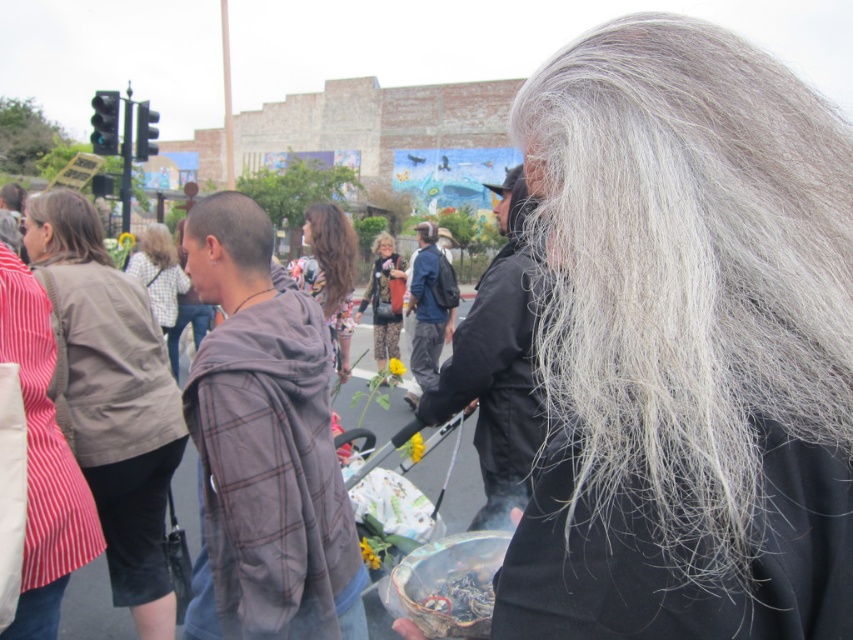
You are a photographer trying to capture a candid shot of the plaid fabric hoodie at center and the white textured shirt at center. Since you want to focus on both items clearly, which one should you zoom in on more to ensure they both fit in the frame?

The plaid fabric hoodie at center occupies less space than the white textured shirt at center, so you should zoom in more on the plaid fabric hoodie at center to ensure both fit in the frame.

You are a photographer trying to capture a group photo of the gray woolen hair at upper right and the short brown hair at center. Given that your camera has a maximum focus range of 60 feet, will both subjects be in focus if you position yourself equidistant between them?

The gray woolen hair at upper right and short brown hair at center are 61.15 feet apart. Since the camera can only focus up to 60 feet, positioning yourself equidistant would mean each is 30.575 feet away from you. This is within the 60 feet range, so both would be in focus.